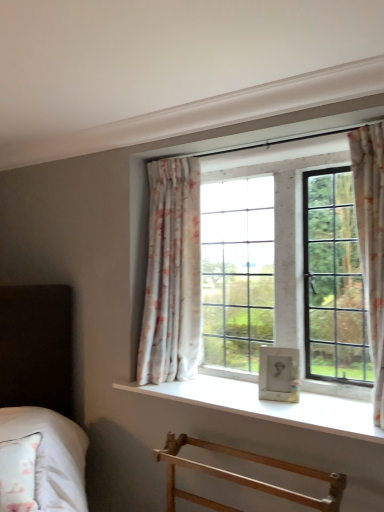
Locate an element on the screen. The height and width of the screenshot is (512, 384). blank space above floral fabric curtain at upper center, which is the 2th curtain in right-to-left order (from a real-world perspective) is located at coordinates (173, 155).